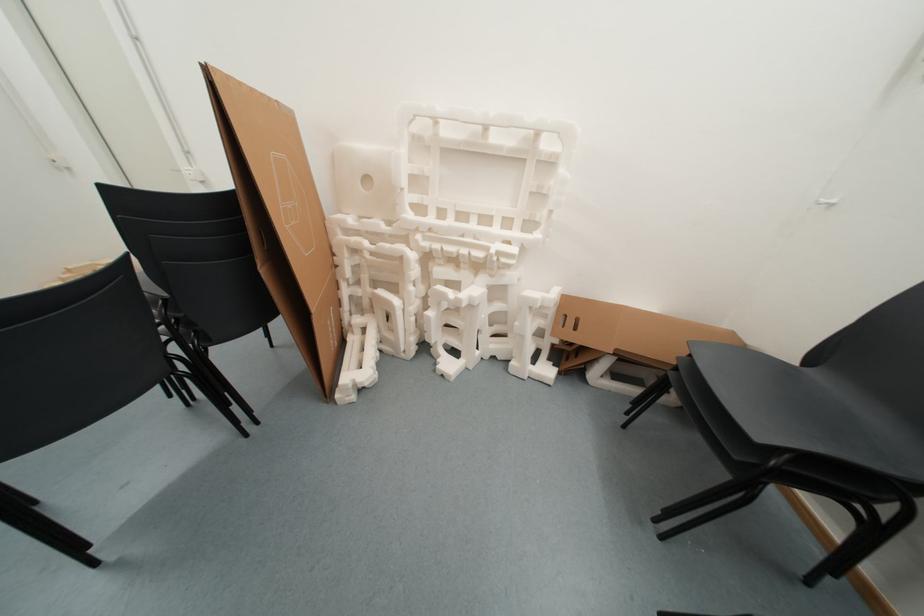
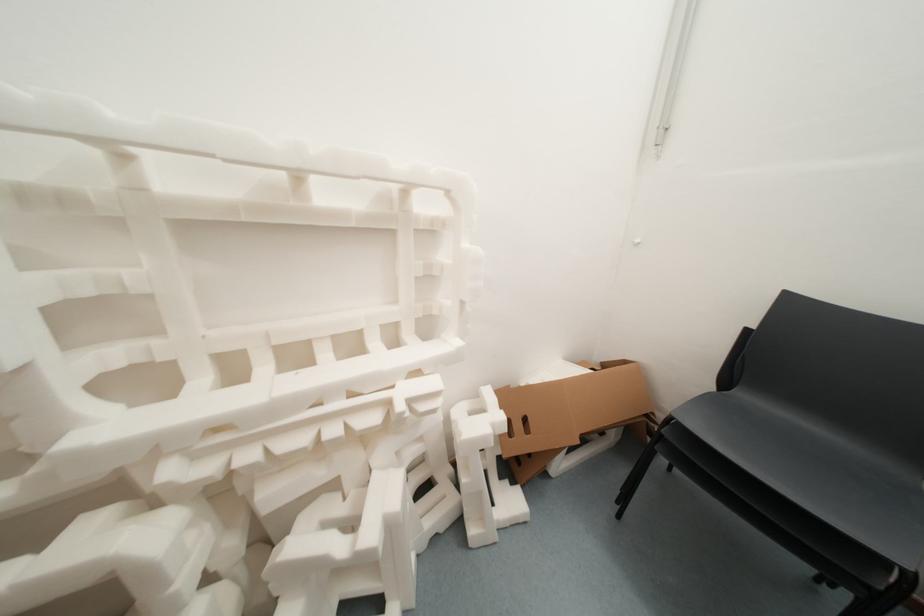
Question: The camera is either moving clockwise (left) or counter-clockwise (right) around the object. The first image is from the beginning of the video and the second image is from the end. Is the camera moving left or right when shooting the video?

Choices:
 (A) Left
 (B) Right

Answer: (A)